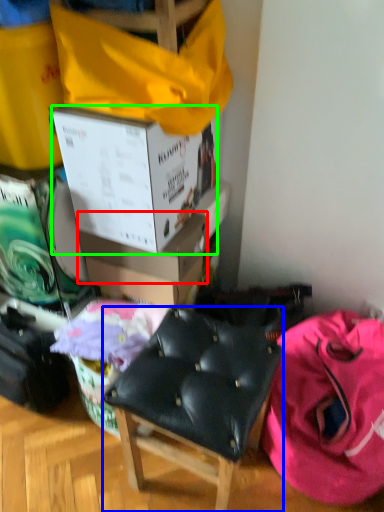
Question: Which object is positioned closest to box (highlighted by a red box)? Select from chair (highlighted by a blue box) and box (highlighted by a green box).

Choices:
 (A) chair
 (B) box

Answer: (B)